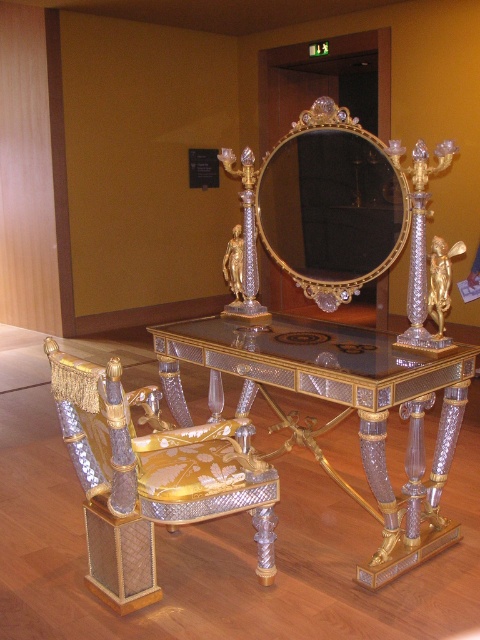
Question: Does gold crystal chair at center appear under gold/gilded mirror at center?

Choices:
 (A) yes
 (B) no

Answer: (A)

Question: Which object is positioned farthest from the gold/glass vanity at center?

Choices:
 (A) gold crystal chair at center
 (B) gold/gilded mirror at center

Answer: (B)

Question: Estimate the real-world distances between objects in this image. Which object is closer to the gold/glass vanity at center?

Choices:
 (A) gold crystal chair at center
 (B) gold/gilded mirror at center

Answer: (A)

Question: Does gold crystal chair at center appear on the right side of gold/gilded mirror at center?

Choices:
 (A) yes
 (B) no

Answer: (B)

Question: Can you confirm if gold crystal chair at center is positioned to the left of gold/gilded mirror at center?

Choices:
 (A) no
 (B) yes

Answer: (B)

Question: Which of the following is the closest to the observer?

Choices:
 (A) (276, 186)
 (B) (439, 476)
 (C) (259, 497)

Answer: (C)